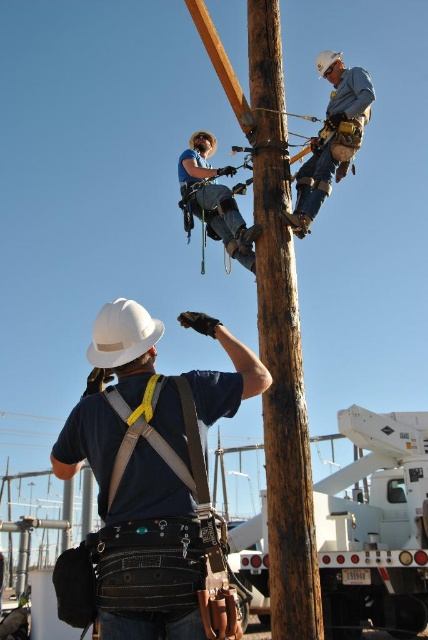
How far apart are brown rough wood telegraph pole at center and white metallic trailer truck at lower right?

They are 14.64 meters apart.

Does point (272, 211) lie in front of point (350, 632)?

Yes, point (272, 211) is in front of point (350, 632).

Which is behind, point (259, 342) or point (327, 513)?

The point (327, 513) is behind.

The image size is (428, 640). Identify the location of brown rough wood telegraph pole at center. (281, 346).

Is point (113, 403) in front of point (335, 134)?

That is True.

Which of these two, white matte hard hat at center or blue denim jeans at upper center, stands taller?

With more height is blue denim jeans at upper center.

Identify the location of white matte hard hat at center. The height and width of the screenshot is (640, 428). (151, 483).

Who is positioned more to the right, blue denim jeans at upper center or white hard hat at center?

Positioned to the right is blue denim jeans at upper center.

Can you confirm if blue denim jeans at upper center is positioned above white hard hat at center?

Yes.

Is point (344, 129) farther from camera compared to point (145, 346)?

Yes, point (344, 129) is farther from viewer.

Locate an element on the screen. This screenshot has height=640, width=428. blue denim jeans at upper center is located at coordinates (332, 138).